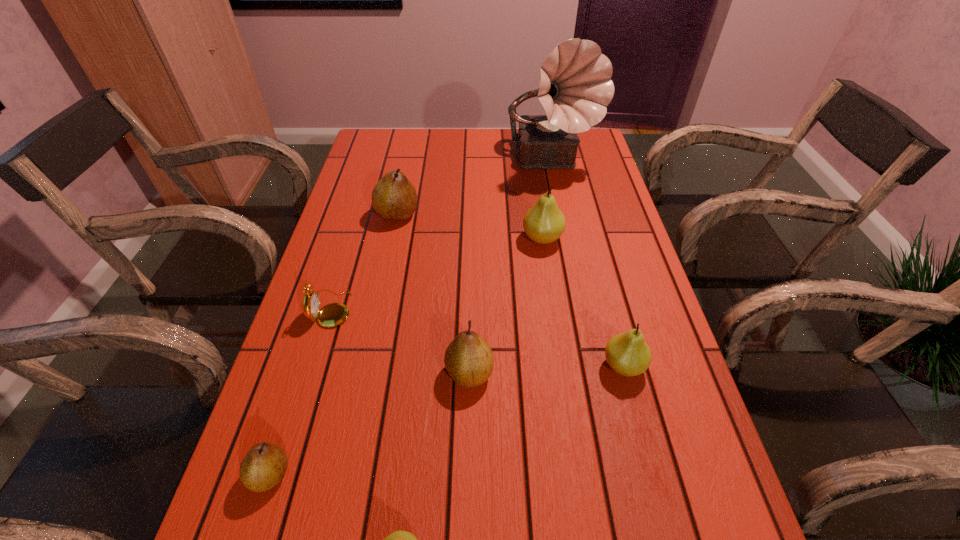
Choose which green pear is the nearest neighbor to the second smallest green pear. Please provide its 2D coordinates. Your answer should be formatted as a tuple, i.e. [(x, y)], where the tuple contains the x and y coordinates of a point satisfying the conditions above.

[(544, 223)]

At what (x,y) coordinates should I click in order to perform the action: click on green pear that is the nearest to the biggest green pear. Please return your answer as a coordinate pair (x, y). This screenshot has width=960, height=540. Looking at the image, I should click on (628, 354).

This screenshot has height=540, width=960. Identify the location of brown pear that is the second closest to the fourth farthest object. (469, 361).

At what (x,y) coordinates should I click in order to perform the action: click on brown pear that can be found as the closest to the second pear from left to right. Please return your answer as a coordinate pair (x, y). This screenshot has height=540, width=960. Looking at the image, I should click on [469, 361].

The image size is (960, 540). I want to click on free space in the image that satisfies the following two spatial constraints: 1. on the face of the pocket watch; 2. on the right side of the rightmost green pear, so click(x=314, y=366).

Identify the location of free space that satisfies the following two spatial constraints: 1. on the face of the second nearest green pear; 2. on the right side of the pocket watch. The height and width of the screenshot is (540, 960). (314, 366).